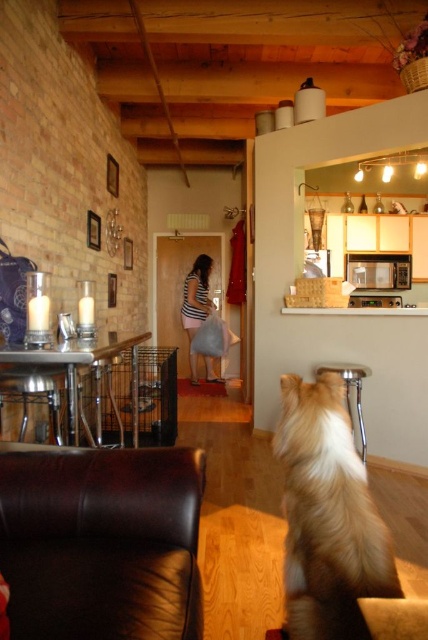
Who is positioned more to the left, fluffy golden dog at center or striped fabric dress at center?

striped fabric dress at center

Based on the photo, can you confirm if fluffy golden dog at center is taller than striped fabric dress at center?

No.

Does point (315, 637) come in front of point (196, 356)?

That is True.

This screenshot has height=640, width=428. What are the coordinates of `fluffy golden dog at center` in the screenshot? It's located at tap(327, 515).

From the picture: Is striped fabric dress at center above metallic silver stool at lower center?

Yes.

Is striped fabric dress at center shorter than metallic silver stool at lower center?

No.

I want to click on striped fabric dress at center, so click(x=196, y=305).

Does fluffy golden dog at center have a lesser height compared to metallic silver stool at lower center?

Indeed, fluffy golden dog at center has a lesser height compared to metallic silver stool at lower center.

Who is more distant from viewer, [344,486] or [348,400]?

Point [348,400]

Identify the location of fluffy golden dog at center. (327, 515).